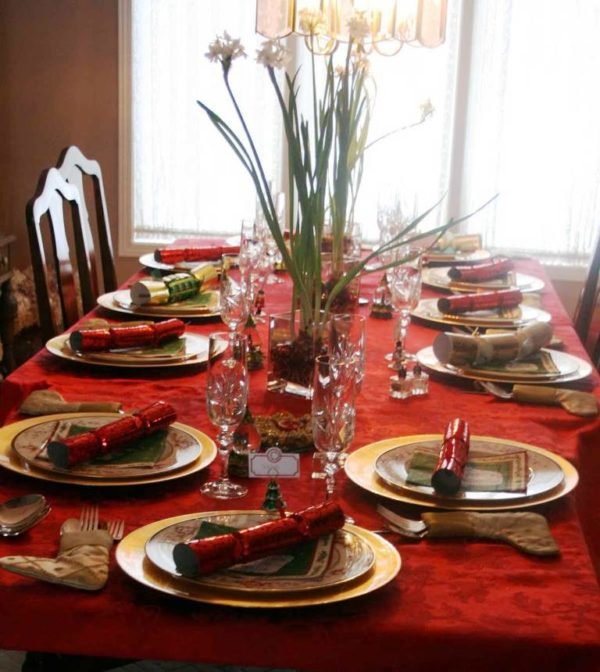
Where is `small plate`? The image size is (600, 672). small plate is located at coordinates (341, 571), (537, 476), (564, 365), (520, 316), (524, 279), (182, 306), (117, 355), (124, 470).